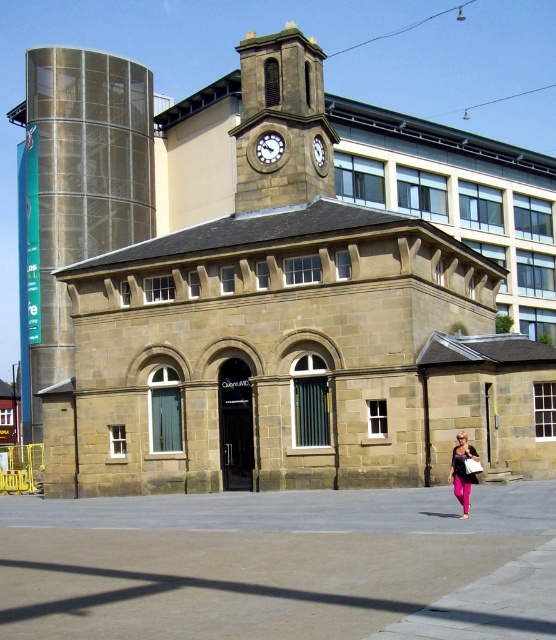
Looking at this image, is brass textured clock at center below white stone clock at upper center?

No.

Does brass textured clock at center appear over white stone clock at upper center?

Yes.

The height and width of the screenshot is (640, 556). I want to click on brass textured clock at center, so click(270, 147).

Which is more to the right, pink fabric pants at lower right or brass textured clock at center?

pink fabric pants at lower right is more to the right.

Can you confirm if pink fabric pants at lower right is positioned to the right of brass textured clock at center?

Correct, you'll find pink fabric pants at lower right to the right of brass textured clock at center.

What do you see at coordinates (463, 472) in the screenshot? I see `pink fabric pants at lower right` at bounding box center [463, 472].

The image size is (556, 640). I want to click on pink fabric pants at lower right, so click(x=463, y=472).

Can you confirm if pink fabric pants at lower right is bigger than white stone clock at upper center?

Yes, pink fabric pants at lower right is bigger than white stone clock at upper center.

Between pink fabric pants at lower right and white stone clock at upper center, which one has less height?

With less height is white stone clock at upper center.

Which is in front, point (468, 509) or point (317, 157)?

Point (468, 509) is in front.

At what (x,y) coordinates should I click in order to perform the action: click on pink fabric pants at lower right. Please return your answer as a coordinate pair (x, y). This screenshot has height=640, width=556. Looking at the image, I should click on tap(463, 472).